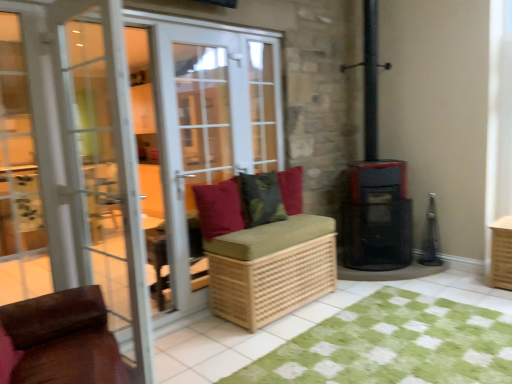
This screenshot has width=512, height=384. I want to click on free spot in front of woven wood bench at center, so click(x=250, y=337).